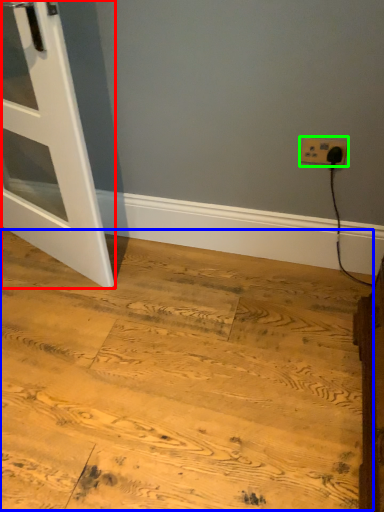
Question: Which is nearer to the door (highlighted by a red box)? plywood (highlighted by a blue box) or power plugs and sockets (highlighted by a green box).

Choices:
 (A) plywood
 (B) power plugs and sockets

Answer: (A)